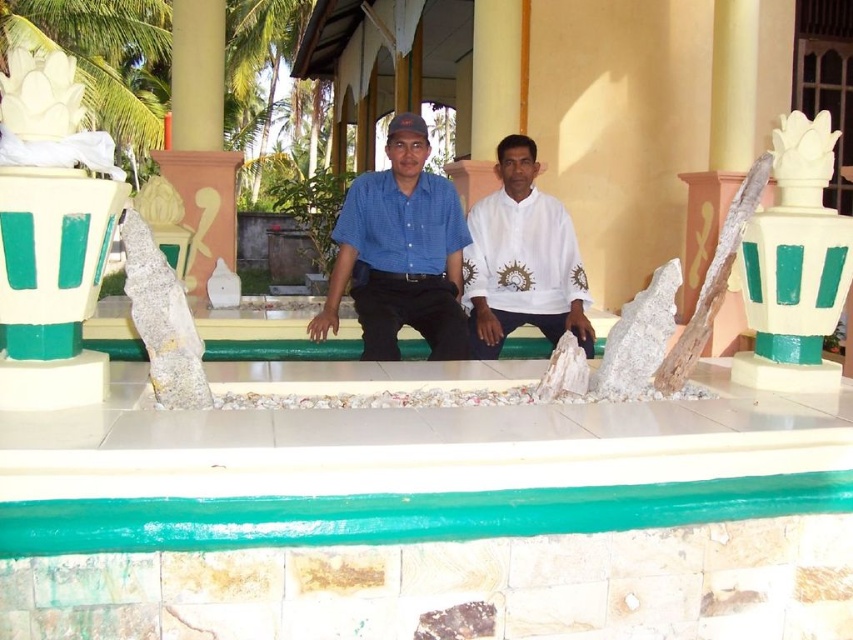
Question: Does white stone pillar at right have a greater width compared to white marble rock at center?

Choices:
 (A) no
 (B) yes

Answer: (B)

Question: Which object is the farthest from the white matte shirt at center?

Choices:
 (A) white marble rock at center
 (B) green painted stone ledge at center
 (C) blue cotton shirt at center

Answer: (A)

Question: Can you confirm if white matte shirt at center is positioned below gray stone sculpture at center?

Choices:
 (A) yes
 (B) no

Answer: (B)

Question: Which point is farther to the camera?

Choices:
 (A) (527, 188)
 (B) (196, 353)

Answer: (A)

Question: Estimate the real-world distances between objects in this image. Which object is farther from the blue cotton shirt at center?

Choices:
 (A) gray stone sculpture at center
 (B) white stone pillar at right

Answer: (B)

Question: Can you confirm if green painted stone ledge at center is wider than gray stone sculpture at center?

Choices:
 (A) no
 (B) yes

Answer: (B)